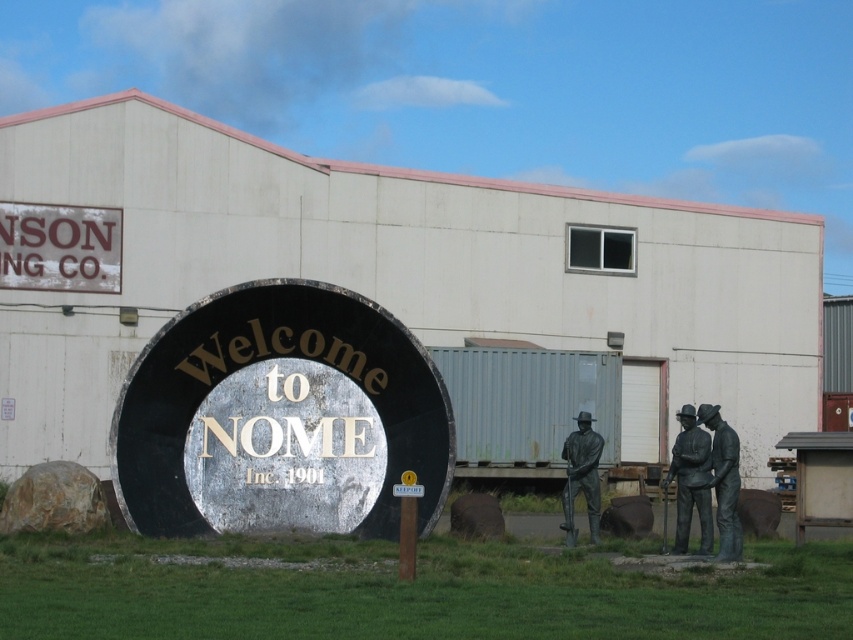
You are standing at the Welcome to Nome sign and want to take a photo of the three bronze statues. You notice two points marked on your map at coordinates point (x=161, y=419) and point (x=717, y=436). Which point should you stand at to ensure the statues are fully visible without any obstruction?

You should stand at point (x=717, y=436) because point (x=161, y=419) is behind it, meaning standing there might block the view of the statues.

You are a visitor standing in front of the rustic brown sign at upper left and the bronze statue at right. Which object is taller?

The rustic brown sign at upper left is taller than the bronze statue at right.

You are standing at the center of the scene in Nome, Alaska. You need to locate the rustic brown sign at upper left. According to the coordinates provided, where exactly is it positioned?

The rustic brown sign at upper left is located at point (59, 248).